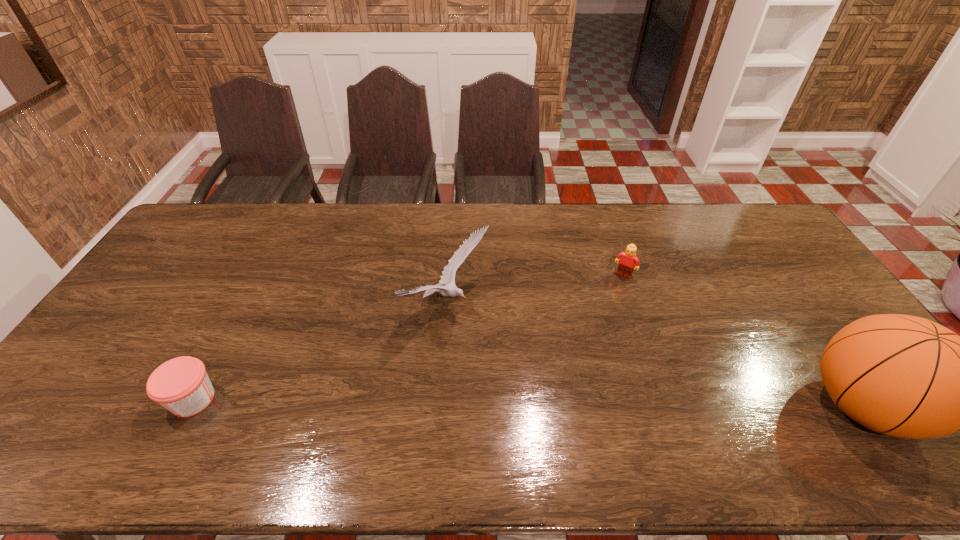
This screenshot has width=960, height=540. In order to click on jam in this screenshot , I will do `click(181, 385)`.

In order to click on the leftmost object in this screenshot , I will do `click(181, 385)`.

The height and width of the screenshot is (540, 960). Identify the location of the tallest object. (905, 376).

Where is `the rightmost object`? the rightmost object is located at coordinates click(905, 376).

Where is `the third tallest object`? the third tallest object is located at coordinates 627,263.

Find the location of a particular element. The width and height of the screenshot is (960, 540). the second object from right to left is located at coordinates (627, 263).

Where is `the third object from right to left`? This screenshot has width=960, height=540. the third object from right to left is located at coordinates (448, 274).

You are a GUI agent. You are given a task and a screenshot of the screen. Output one action in this format:
    pyautogui.click(x=<x>, y=<y>)
    Task: Click on the gull
    
    Given the screenshot: What is the action you would take?
    pyautogui.click(x=448, y=274)

Image resolution: width=960 pixels, height=540 pixels. What are the coordinates of `free region located on the front label of the shortest object` in the screenshot? It's located at (81, 399).

The height and width of the screenshot is (540, 960). Identify the location of free space located 0.140m on the front label of the shortest object. click(112, 399).